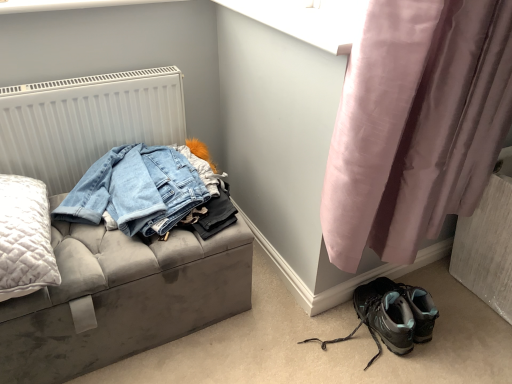
Question: Considering the positions of matte black hiking boots at lower right and pink satin curtain at lower right in the image, is matte black hiking boots at lower right taller or shorter than pink satin curtain at lower right?

Choices:
 (A) tall
 (B) short

Answer: (B)

Question: In terms of size, does matte black hiking boots at lower right appear bigger or smaller than pink satin curtain at lower right?

Choices:
 (A) big
 (B) small

Answer: (B)

Question: Considering the real-world distances, which object is closest to the velvet grey storage bench at left?

Choices:
 (A) pink satin curtain at lower right
 (B) matte black hiking boots at lower right
 (C) white textured radiator at upper left

Answer: (C)

Question: Which is farther from the matte black hiking boots at lower right?

Choices:
 (A) pink satin curtain at lower right
 (B) velvet grey storage bench at left
 (C) white textured radiator at upper left

Answer: (C)